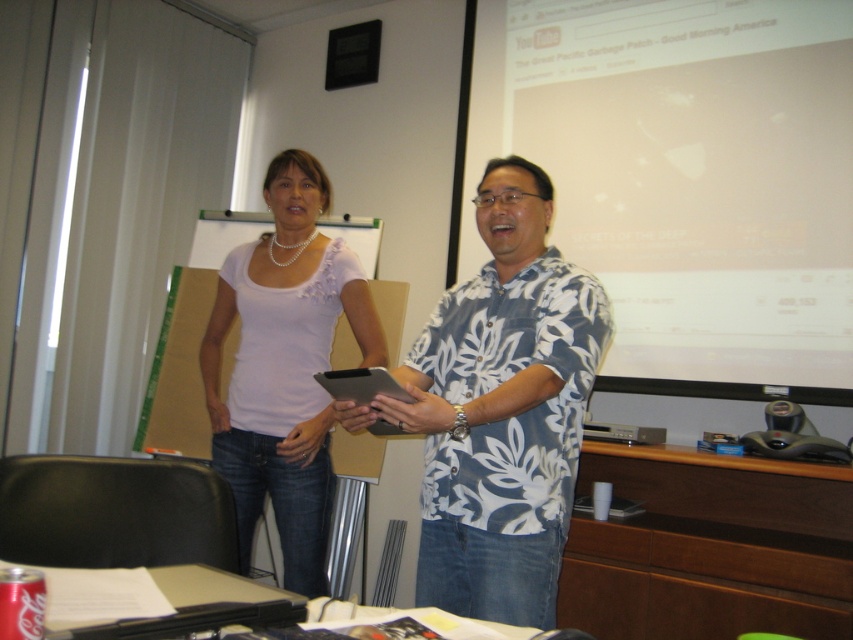
You are organizing a photoshoot and need to decide which clothing item to feature based on their size. The scene shows a white floral shirt at center and a matte white blouse at center. Which one is narrower?

The white floral shirt at center is narrower than the matte white blouse at center.